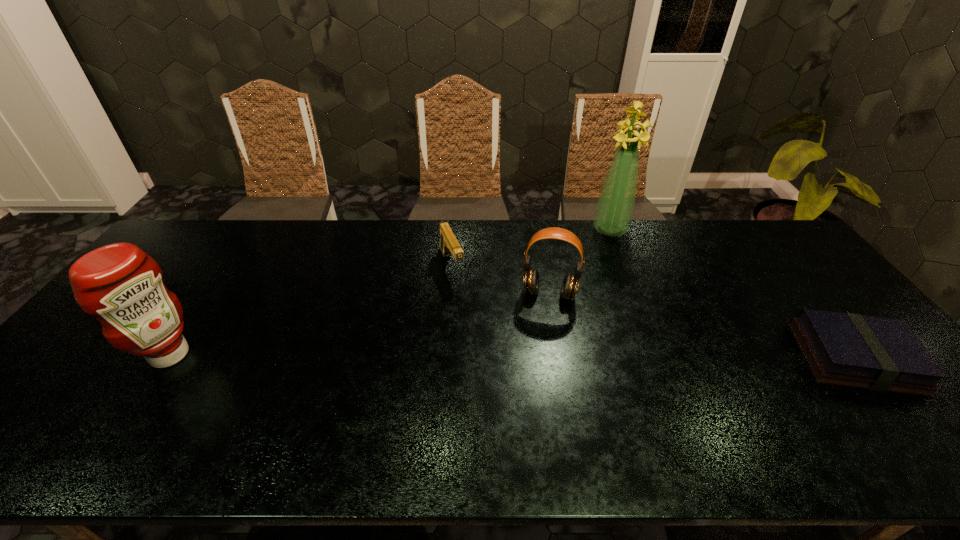
Locate an element on the screen. This screenshot has height=540, width=960. free spot located on the ear cups of the third object from right to left is located at coordinates (531, 396).

Where is `bouquet at the far edge`? This screenshot has width=960, height=540. bouquet at the far edge is located at coordinates (615, 207).

I want to click on pistol present at the far edge, so click(x=449, y=245).

This screenshot has height=540, width=960. Find the location of `object located in the near edge section of the desktop`. object located in the near edge section of the desktop is located at coordinates (882, 354).

Identify the location of object that is positioned at the right edge. This screenshot has width=960, height=540. (882, 354).

Locate an element on the screen. object at the near right corner is located at coordinates (882, 354).

This screenshot has height=540, width=960. What are the coordinates of `vacant region at the far edge of the desktop` in the screenshot? It's located at (738, 243).

This screenshot has width=960, height=540. Identify the location of vacant space at the left edge. (113, 371).

This screenshot has width=960, height=540. In the image, there is a desktop. What are the coordinates of `vacant space at the right edge` in the screenshot? It's located at (780, 277).

Identify the location of vacant area at the far left corner of the desktop. (220, 227).